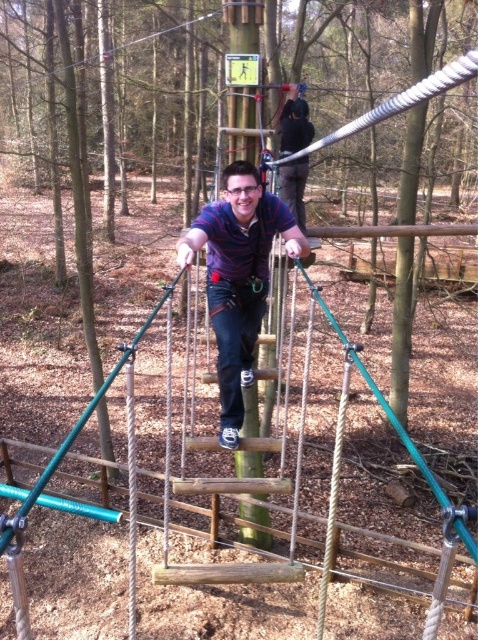
Question: Which point is closer to the camera taking this photo?

Choices:
 (A) pos(189,228)
 (B) pos(288,134)

Answer: (A)

Question: Does striped cotton shirt at center have a larger size compared to matte blue shirt at center?

Choices:
 (A) no
 (B) yes

Answer: (B)

Question: Is striped cotton shirt at center positioned at the back of matte blue shirt at center?

Choices:
 (A) yes
 (B) no

Answer: (B)

Question: Is striped cotton shirt at center further to the viewer compared to matte blue shirt at center?

Choices:
 (A) yes
 (B) no

Answer: (B)